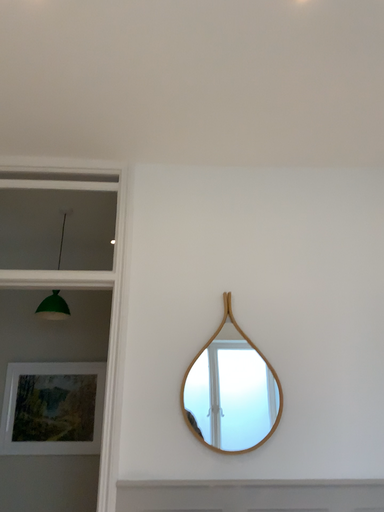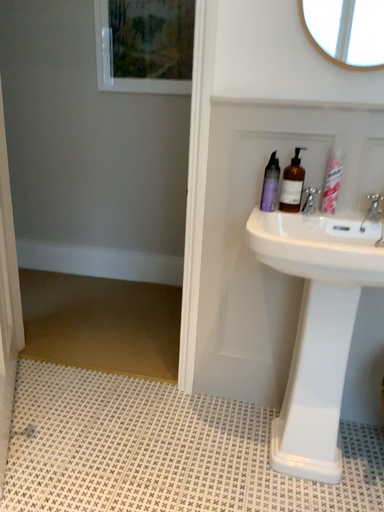
Question: How did the camera likely rotate when shooting the video?

Choices:
 (A) rotated downward
 (B) rotated upward

Answer: (A)